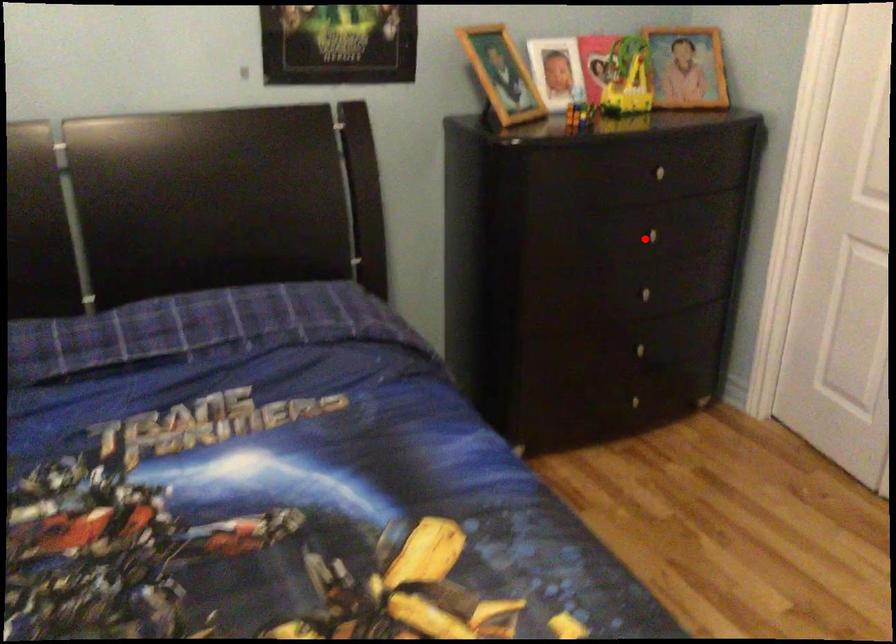
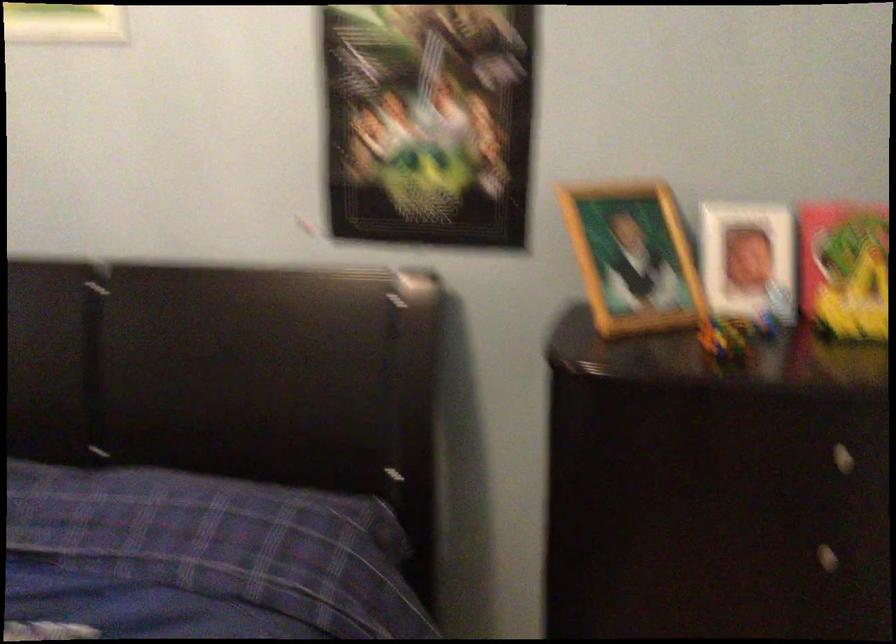
The point at the highlighted location is marked in the first image. Where is the corresponding point in the second image?

(807, 554)